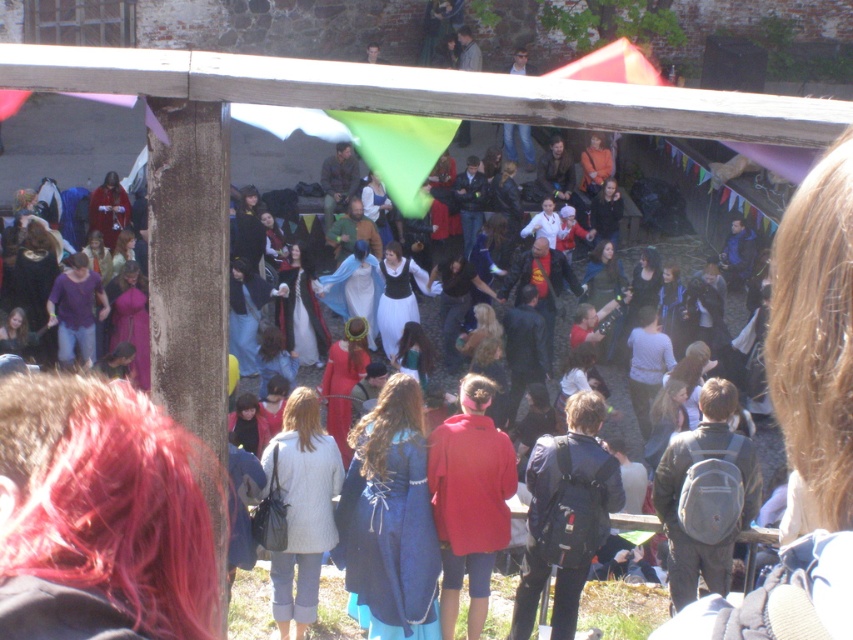
Who is lower down, matte red hoodie at center or dark blue fabric coat at center?

dark blue fabric coat at center is below.

Between matte red hoodie at center and dark blue fabric coat at center, which one appears on the right side from the viewer's perspective?

dark blue fabric coat at center is more to the right.

The width and height of the screenshot is (853, 640). What do you see at coordinates (469, 500) in the screenshot?
I see `matte red hoodie at center` at bounding box center [469, 500].

I want to click on matte red hoodie at center, so click(469, 500).